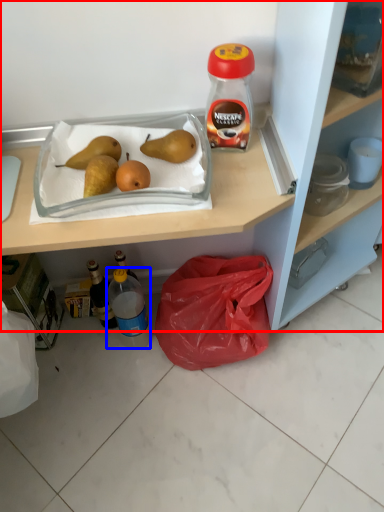
Question: Which of the following is the farthest to the observer, cabinetry (highlighted by a red box) or bottle (highlighted by a blue box)?

Choices:
 (A) cabinetry
 (B) bottle

Answer: (B)